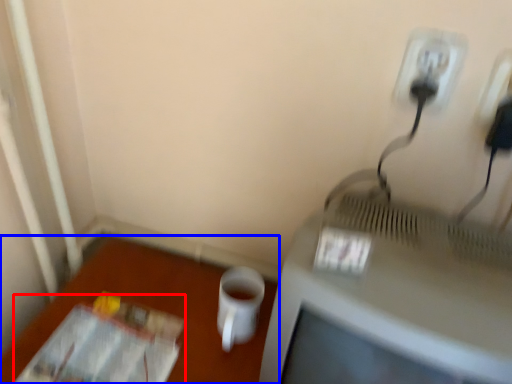
Question: Which object is closer to the camera taking this photo, magazine (highlighted by a red box) or table (highlighted by a blue box)?

Choices:
 (A) magazine
 (B) table

Answer: (A)